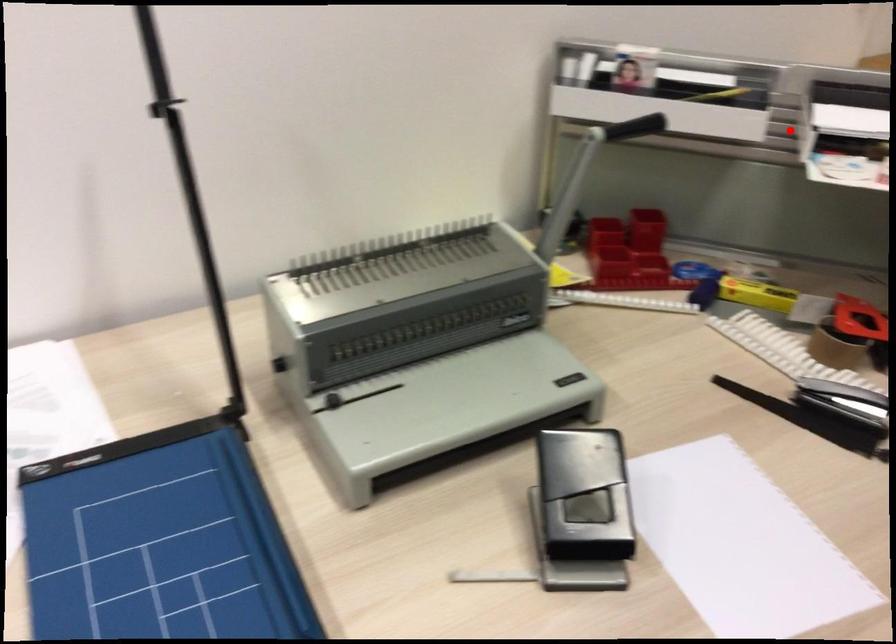
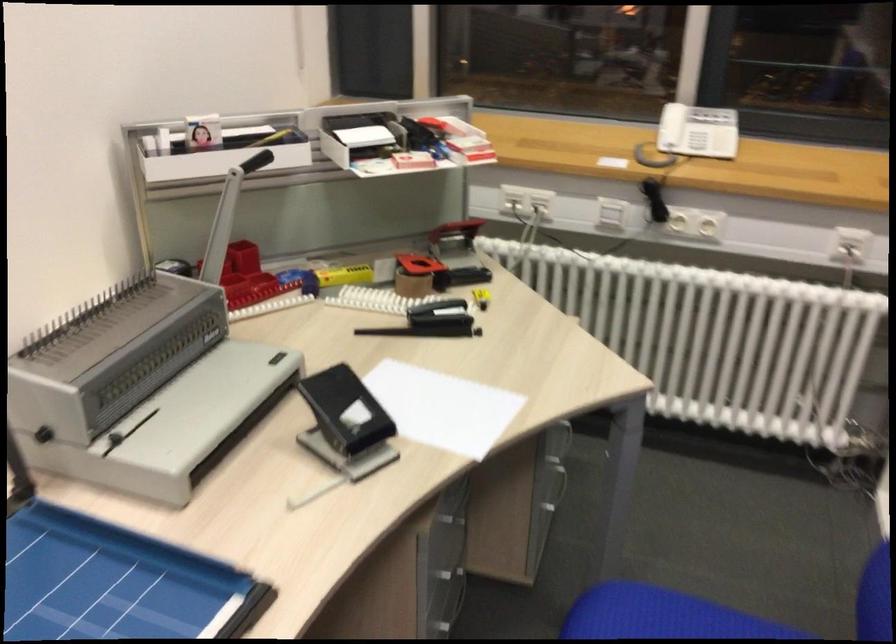
Where in the second image is the point corresponding to the highlighted location from the first image?

(334, 149)